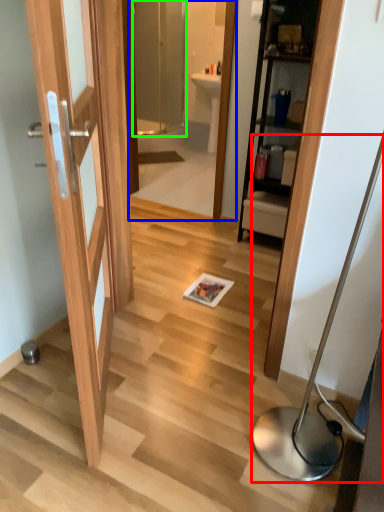
Question: Which object is the closest to the table lamp (highlighted by a red box)? Choose among these: mirror (highlighted by a blue box) or screen door (highlighted by a green box).

Choices:
 (A) mirror
 (B) screen door

Answer: (A)